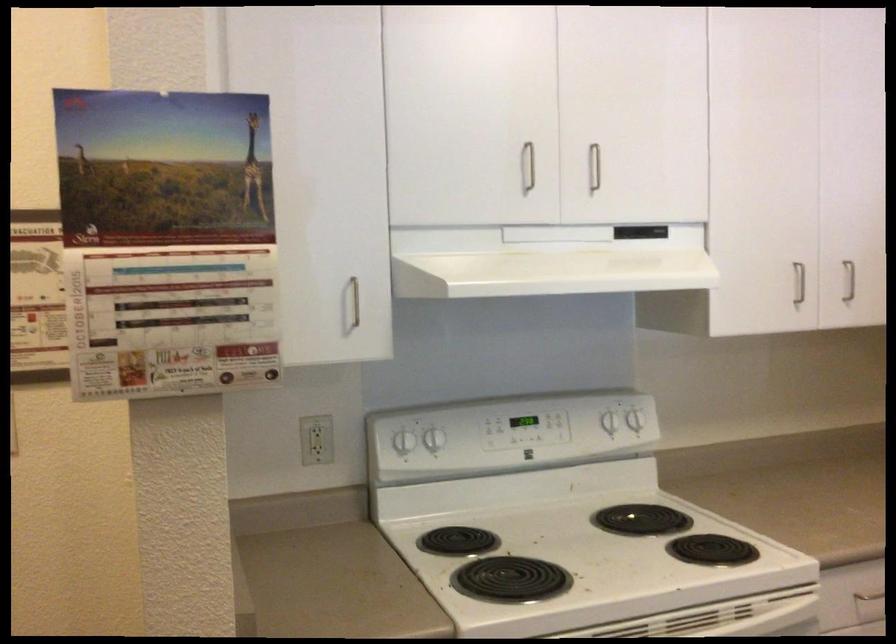
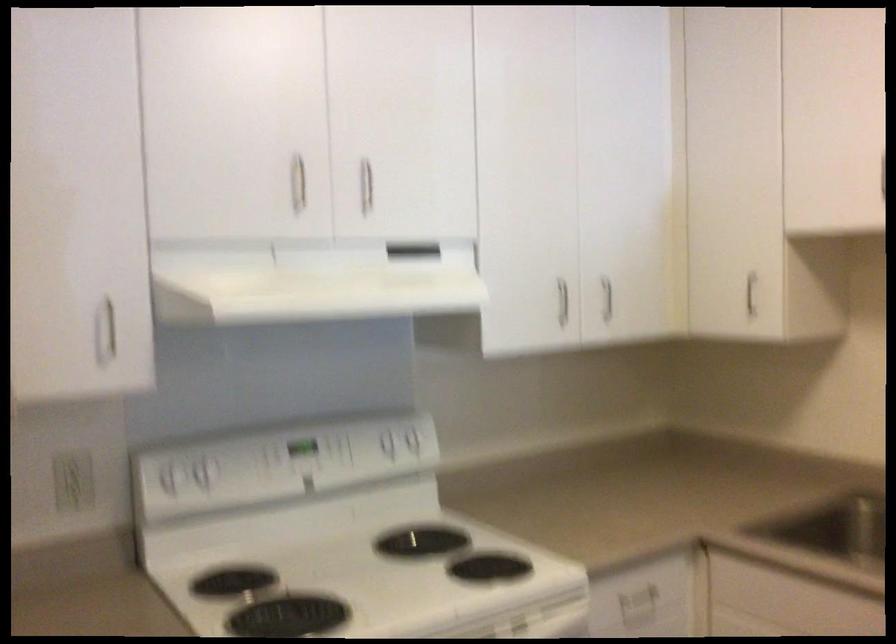
In the second image, find the point that corresponds to pixel 402 439 in the first image.

(169, 476)